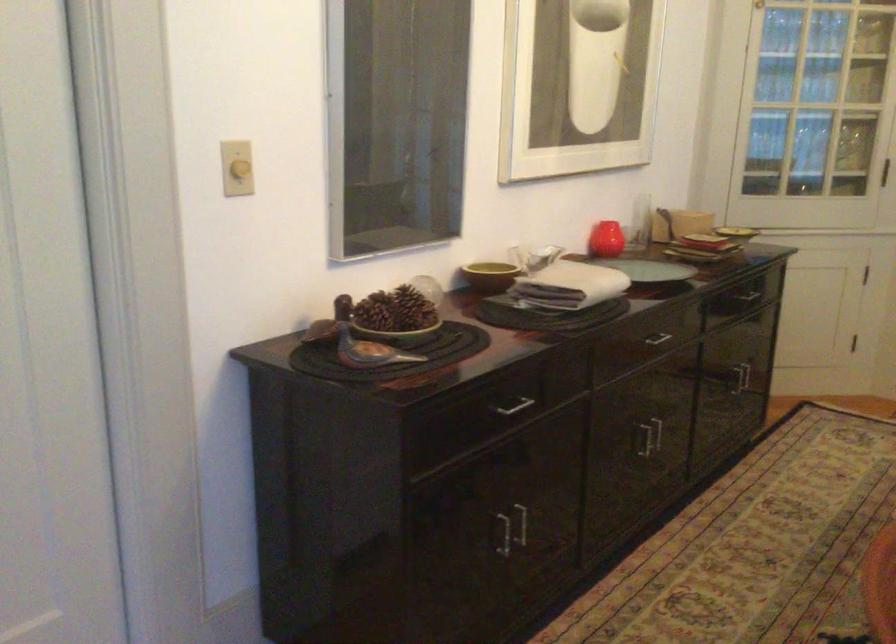
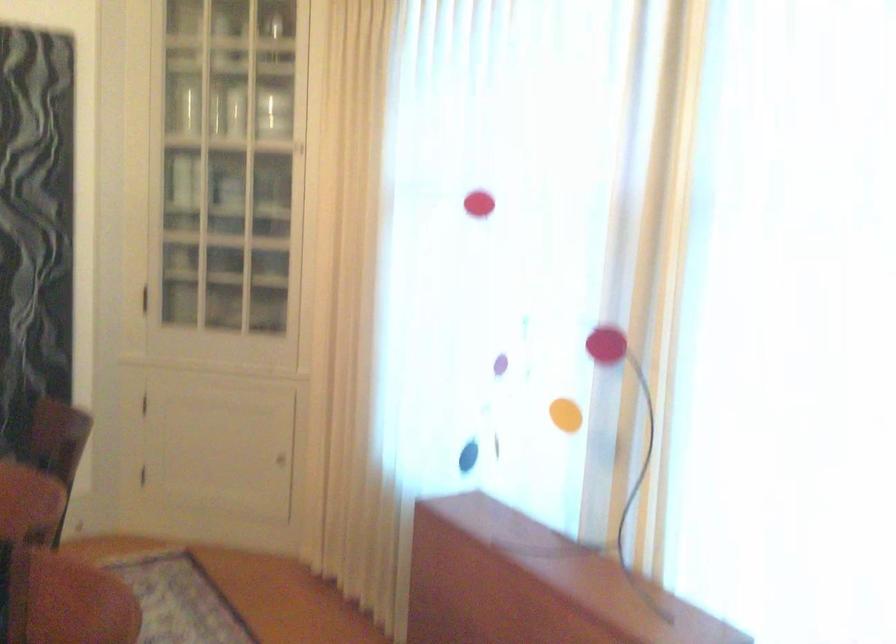
Question: The camera is either moving clockwise (left) or counter-clockwise (right) around the object. The first image is from the beginning of the video and the second image is from the end. Is the camera moving left or right when shooting the video?

Choices:
 (A) Left
 (B) Right

Answer: (A)